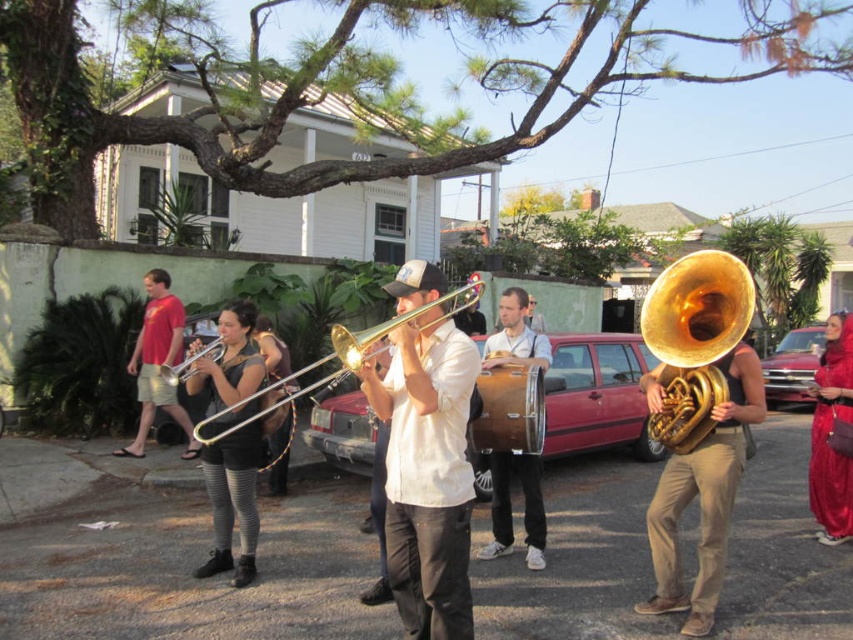
Question: From the image, what is the correct spatial relationship of gold shiny trumpet at center in relation to metallic red car at right?

Choices:
 (A) right
 (B) left

Answer: (B)

Question: Considering the real-world distances, which object is farthest from the wooden drum at center?

Choices:
 (A) brushed metal trumpet at center
 (B) shiny gold trombone at center

Answer: (A)

Question: Which of the following is the farthest from the observer?

Choices:
 (A) (822, 509)
 (B) (202, 353)
 (C) (485, 364)

Answer: (A)

Question: Which object is farther from the camera taking this photo?

Choices:
 (A) shiny gold trombone at center
 (B) metallic red car at center
 (C) gold shiny trumpet at center
 (D) black jersey at center

Answer: (B)

Question: Is gold shiny trumpet at center positioned behind black leather pants at center?

Choices:
 (A) no
 (B) yes

Answer: (A)

Question: Is wooden drum at center thinner than shiny red dress at right?

Choices:
 (A) no
 (B) yes

Answer: (A)